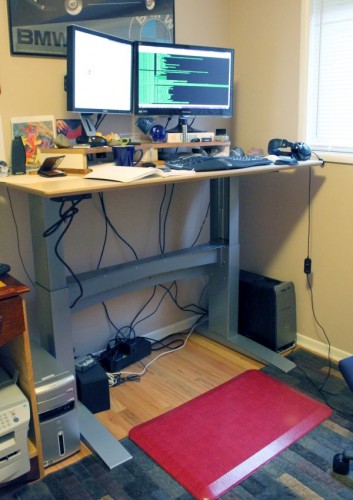
Where is `wall painted white`? wall painted white is located at coordinates (275, 70), (31, 75).